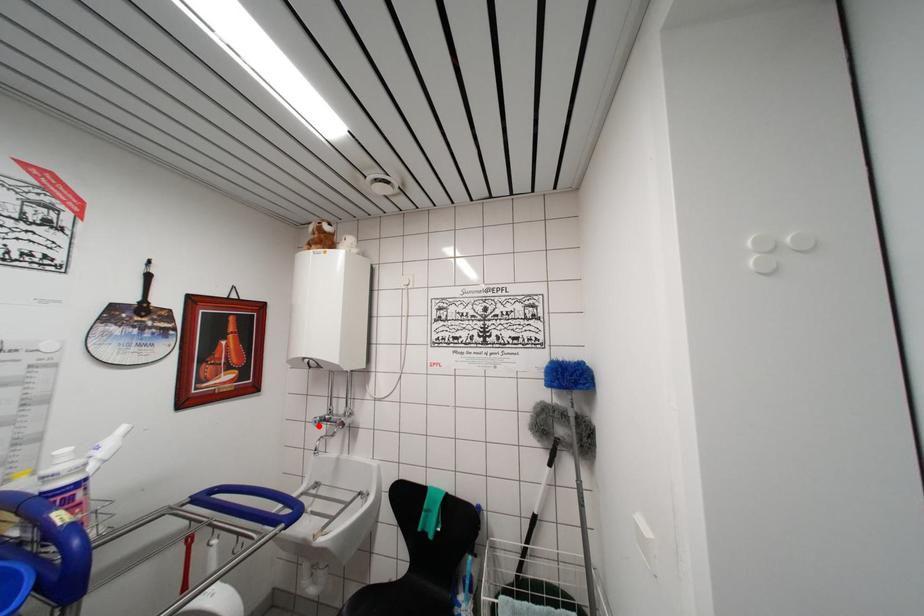
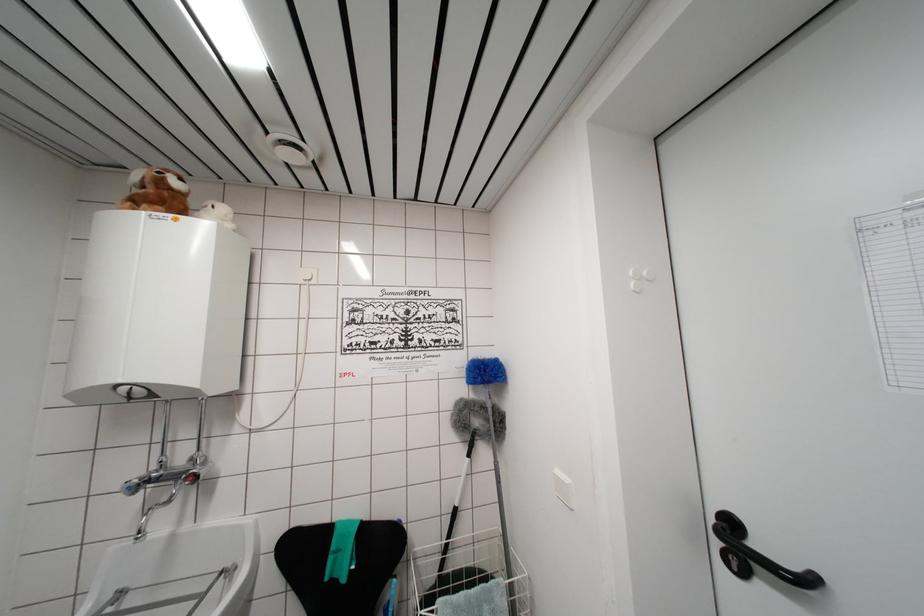
Find the pixel in the second image that matches the highlighted location in the first image.

(132, 493)